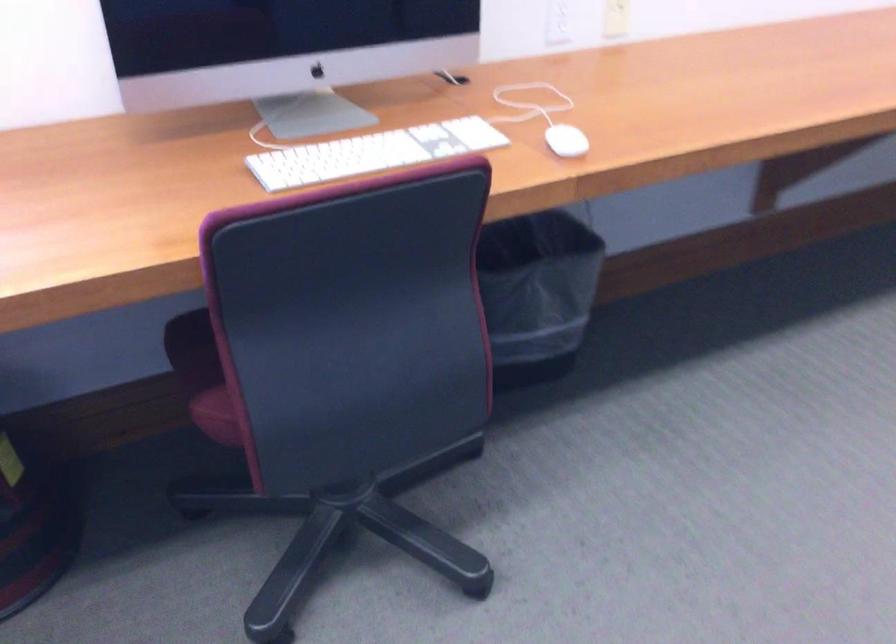
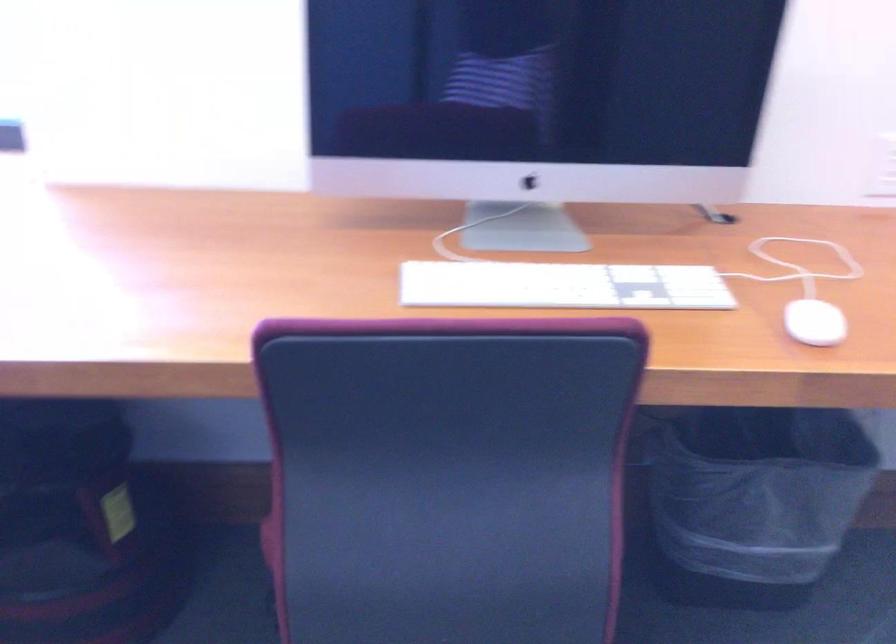
Question: The camera is either moving clockwise (left) or counter-clockwise (right) around the object. The first image is from the beginning of the video and the second image is from the end. Is the camera moving left or right when shooting the video?

Choices:
 (A) Left
 (B) Right

Answer: (B)